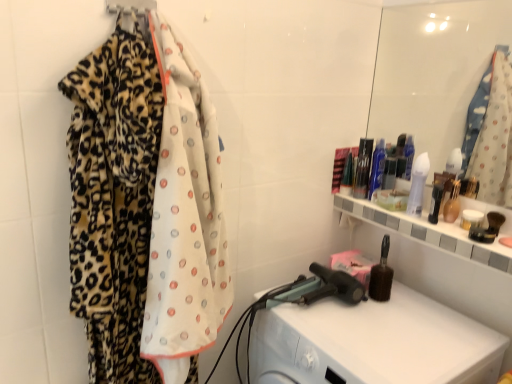
The image size is (512, 384). Identify the location of vacant space that is to the left of brown wooden brush at lower right, which is the sixth toiletry from right to left. (336, 309).